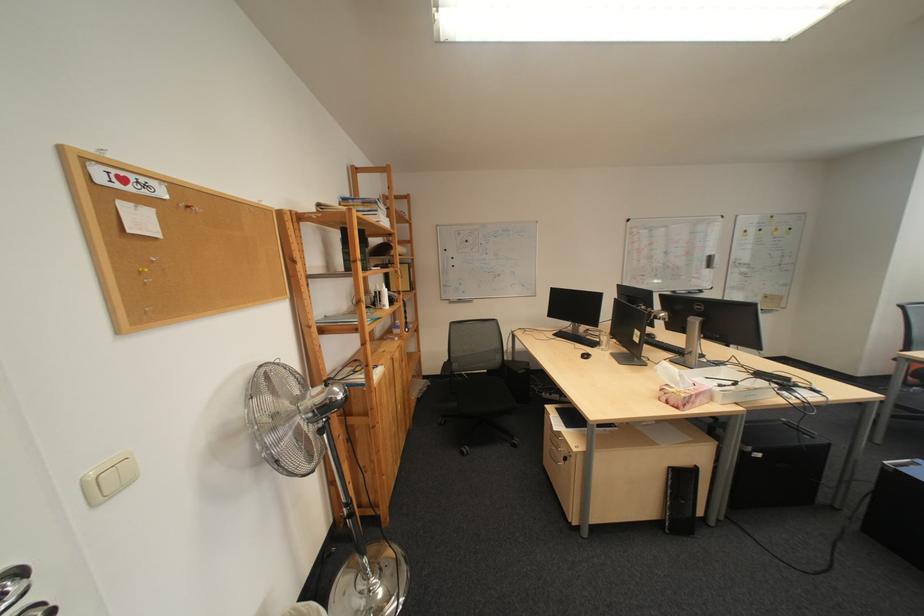
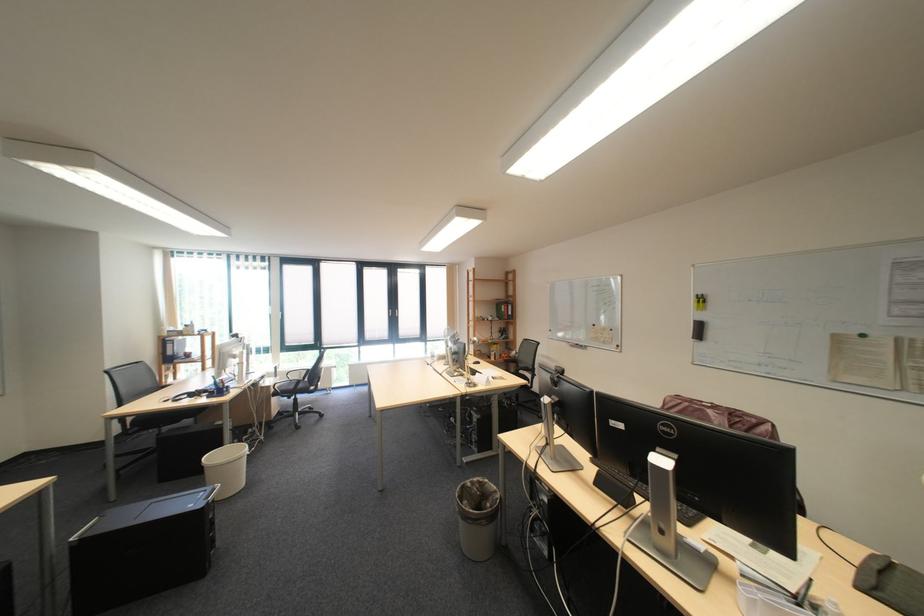
Question: The camera is either moving clockwise (left) or counter-clockwise (right) around the object. The first image is from the beginning of the video and the second image is from the end. Is the camera moving left or right when shooting the video?

Choices:
 (A) Left
 (B) Right

Answer: (A)